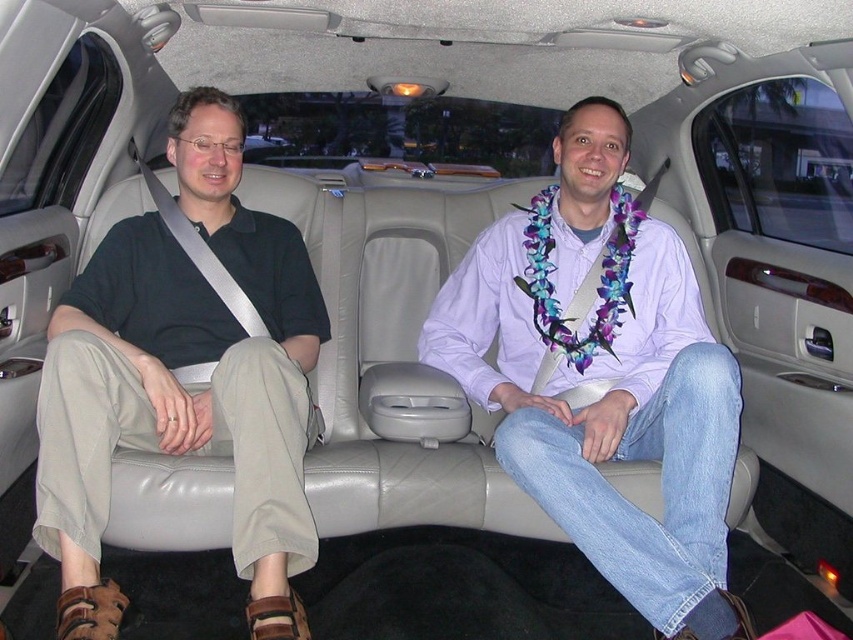
You are standing at the point marked as point [440,337] in the car. You want to take a photo of the entire backseat area using a camera that has a maximum focus range of 2.5 meters. Will the camera be able to capture the entire backseat area clearly?

The distance between point [440,337] and the camera is exactly 2.50 meters. Since the camera has a maximum focus range of 2.5 meters, it can capture the entire backseat area clearly as the distance is within the focus range.

You are a photographer taking a portrait of both the light purple shirt at center and the dark green polo shirt at left. To ensure both are in focus, you need to know which one is taller. Which shirt is taller?

The light purple shirt at center is taller than the dark green polo shirt at left according to the description.

You are sitting in the back of a luxurious limousine with beige leather seats. You notice two points marked in the scene. Which point, point (465, 296) or point (306, 397), is closer to you?

Point (465, 296) is closer to you because it is further to the viewer than point (306, 397).